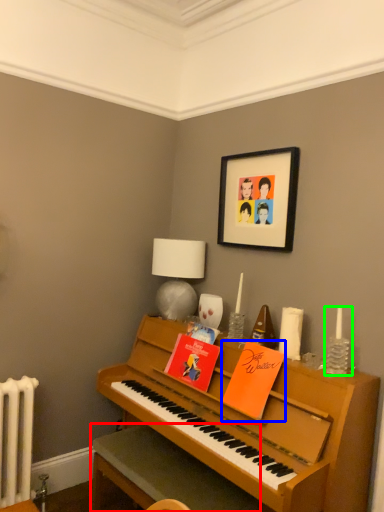
Question: Which is farther away from table (highlighted by a red box)? book (highlighted by a blue box) or candle holder (highlighted by a green box)?

Choices:
 (A) book
 (B) candle holder

Answer: (B)